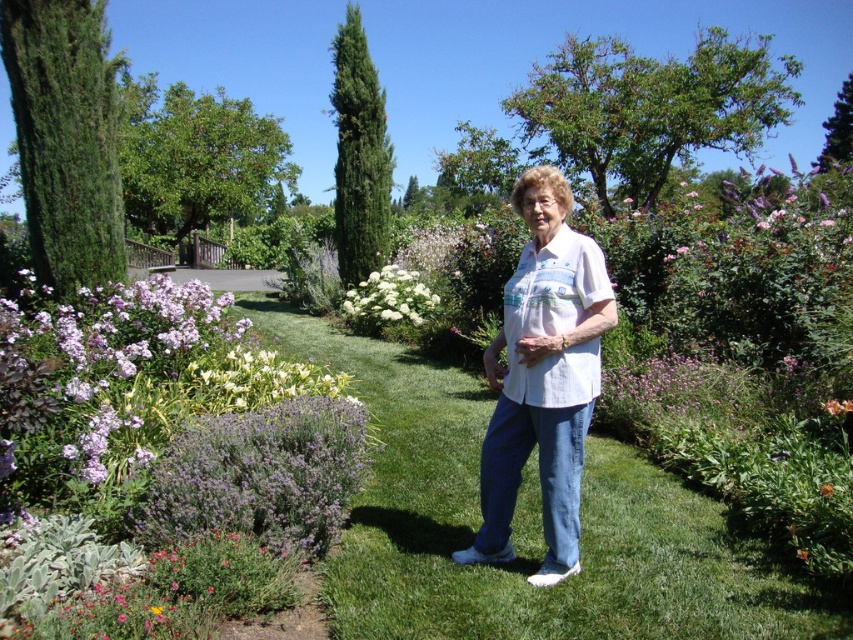
Who is more distant from viewer, (521, 408) or (439, 248)?

The point (439, 248) is more distant.

Locate an element on the screen. white cotton shirt at center is located at coordinates (543, 378).

Locate an element on the screen. The height and width of the screenshot is (640, 853). white cotton shirt at center is located at coordinates (543, 378).

Identify the location of white cotton shirt at center. (543, 378).

Which is behind, point (549, 211) or point (830, 484)?

Positioned behind is point (830, 484).

In order to click on white cotton shirt at center in this screenshot , I will do `click(543, 378)`.

From the picture: Does green needle-like at upper center appear on the right side of purple matte flower at center?

No, green needle-like at upper center is not to the right of purple matte flower at center.

Does green needle-like at upper center have a larger size compared to purple matte flower at center?

Indeed, green needle-like at upper center has a larger size compared to purple matte flower at center.

Who is more forward, (x=392, y=161) or (x=401, y=266)?

Point (x=392, y=161) is more forward.

Find the location of a particular element. The image size is (853, 640). green needle-like at upper center is located at coordinates (358, 154).